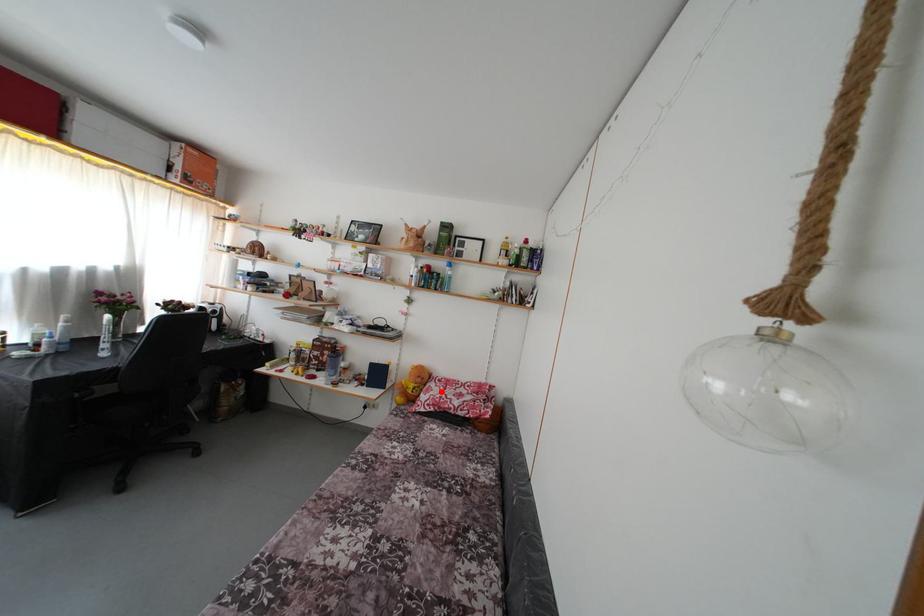
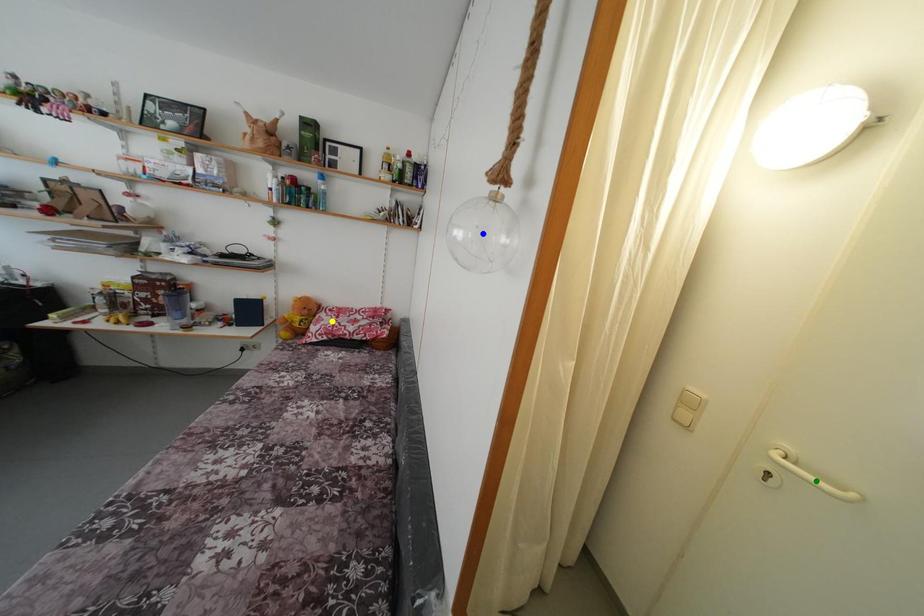
Question: I am providing you with two images of the same scene from different viewpoints. A red point is marked on the first image. You are given multiple points on the second image. Which mark in image 2 goes with the point in image 1?

Choices:
 (A) blue point
 (B) yellow point
 (C) green point

Answer: (B)